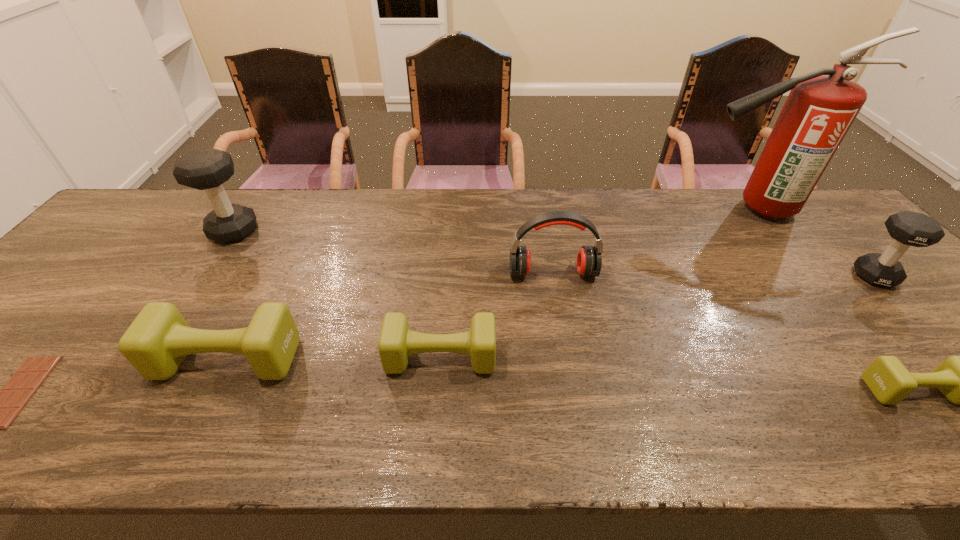
At what (x,y) coordinates should I click in order to perform the action: click on red fire extinguisher. Please return your answer as a coordinate pair (x, y). Looking at the image, I should click on (819, 110).

Locate an element on the screen. This screenshot has width=960, height=540. fire extinguisher is located at coordinates (819, 110).

The width and height of the screenshot is (960, 540). Find the location of `the left gray dumbbell`. the left gray dumbbell is located at coordinates (207, 169).

In order to click on the tallest dumbbell in this screenshot , I will do [207, 169].

In order to click on earphone in this screenshot , I will do `click(589, 259)`.

Find the location of a particular element. red earphone is located at coordinates (589, 259).

Image resolution: width=960 pixels, height=540 pixels. Identify the location of the right gray dumbbell. (907, 228).

Locate an element on the screen. the second farthest dumbbell is located at coordinates (907, 228).

What are the coordinates of `the fourth shortest object` in the screenshot? It's located at (156, 343).

You are a GUI agent. You are given a task and a screenshot of the screen. Output one action in this format:
    pyautogui.click(x=<x>, y=<y>)
    Task: Click on the third tallest dumbbell
    
    Given the screenshot: What is the action you would take?
    pyautogui.click(x=156, y=343)